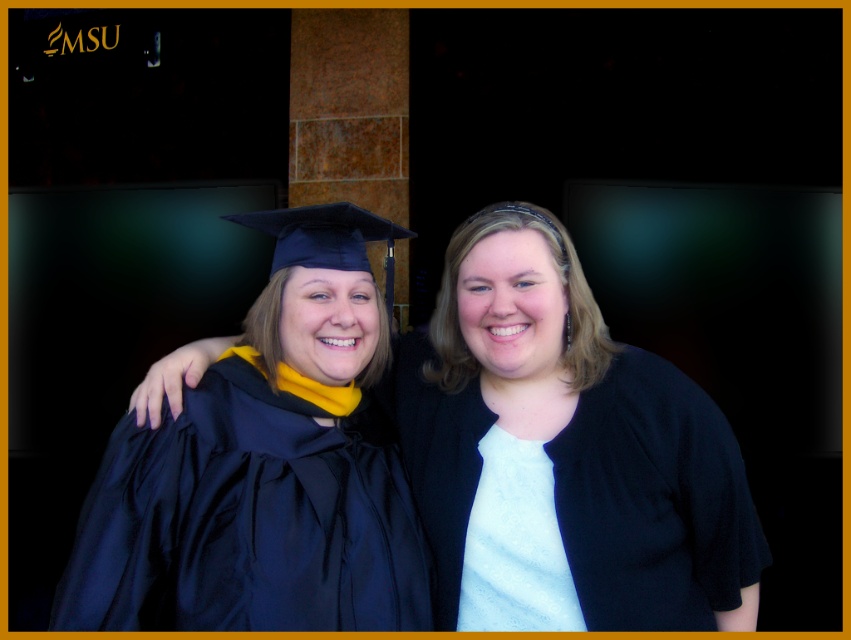
Question: Which of these objects is positioned farthest from the matte black graduation gown at left?

Choices:
 (A) white matte shirt at center
 (B) matte black graduation gown at center

Answer: (A)

Question: Can you confirm if matte black graduation gown at center is positioned to the right of white matte shirt at center?

Choices:
 (A) yes
 (B) no

Answer: (A)

Question: Does matte black graduation gown at center have a lesser width compared to white matte shirt at center?

Choices:
 (A) yes
 (B) no

Answer: (A)

Question: Estimate the real-world distances between objects in this image. Which object is closer to the white matte shirt at center?

Choices:
 (A) matte black graduation gown at center
 (B) matte black graduation gown at left

Answer: (A)

Question: Is matte black graduation gown at left to the right of white matte shirt at center from the viewer's perspective?

Choices:
 (A) no
 (B) yes

Answer: (A)

Question: Considering the real-world distances, which object is farthest from the matte black graduation gown at left?

Choices:
 (A) white matte shirt at center
 (B) matte black graduation gown at center

Answer: (A)